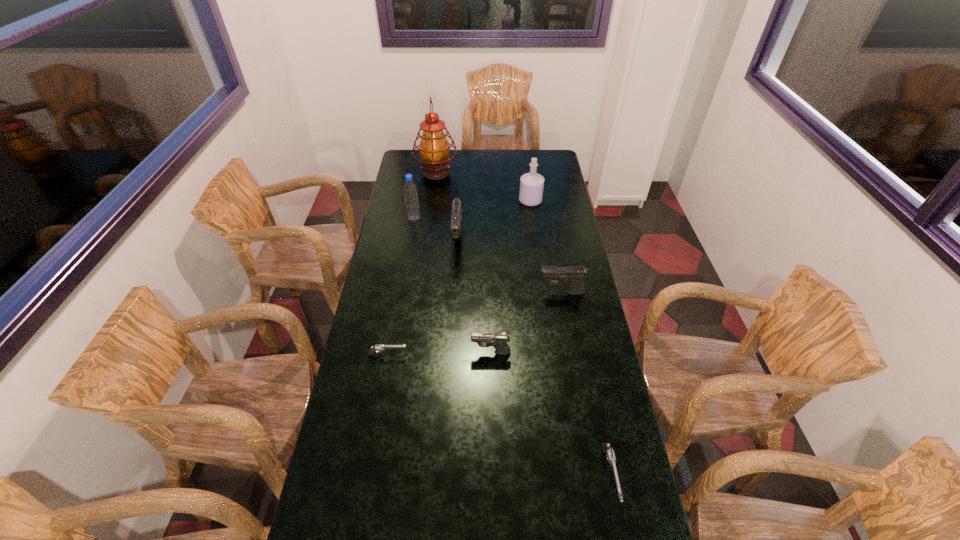
Find the location of a particular element. the nearest black pistol is located at coordinates (498, 340).

Image resolution: width=960 pixels, height=540 pixels. Find the location of `the fourth tallest pistol`. the fourth tallest pistol is located at coordinates (606, 447).

Locate an element on the screen. This screenshot has height=540, width=960. the nearer silver pistol is located at coordinates (606, 447).

Where is `the leftmost pistol`? Image resolution: width=960 pixels, height=540 pixels. the leftmost pistol is located at coordinates (373, 349).

Find the location of a particular element. The image size is (960, 540). the shortest pistol is located at coordinates (373, 349).

Identify the location of free space located on the right of the oil lamp. The width and height of the screenshot is (960, 540). (508, 172).

Locate an element on the screen. This screenshot has width=960, height=540. vacant space located 0.060m on the front of the second farthest object is located at coordinates (533, 215).

Identify the location of free space located 0.270m on the right of the sixth nearest object. (479, 218).

Locate an element on the screen. vacant point located 0.140m at the barrel of the farthest pistol is located at coordinates (456, 282).

You are a GUI agent. You are given a task and a screenshot of the screen. Output one action in this format:
    pyautogui.click(x=<x>, y=<y>)
    Task: Click on the vacant space located at the barrel of the fifth farthest object
    
    Given the screenshot: What is the action you would take?
    pyautogui.click(x=445, y=293)